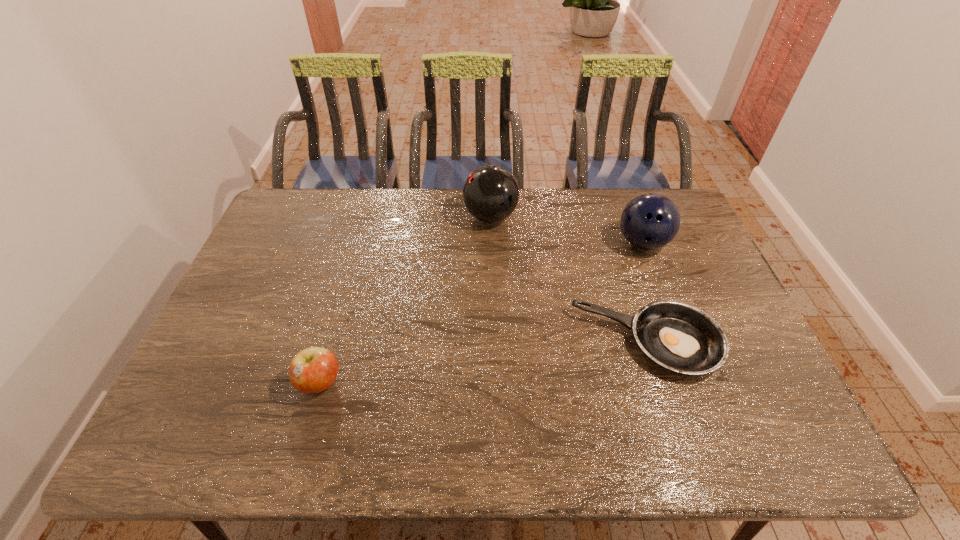
Select which object is the third closest to the right bowling ball. Please provide its 2D coordinates. Your answer should be formatted as a tuple, i.e. [(x, y)], where the tuple contains the x and y coordinates of a point satisfying the conditions above.

[(312, 370)]

Locate an element on the screen. The height and width of the screenshot is (540, 960). free space that satisfies the following two spatial constraints: 1. on the surface of the third object from right to left near the finger holes; 2. on the right side of the shortest object is located at coordinates (x=493, y=343).

Locate an element on the screen. The width and height of the screenshot is (960, 540). vacant point that satisfies the following two spatial constraints: 1. on the surface of the third object from right to left near the finger holes; 2. on the front side of the leftmost object is located at coordinates (494, 382).